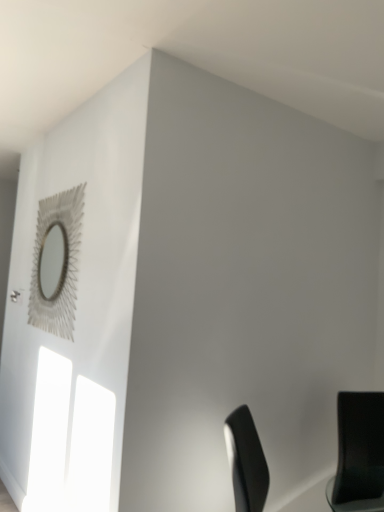
You are a GUI agent. You are given a task and a screenshot of the screen. Output one action in this format:
    pyautogui.click(x=<x>, y=<y>)
    Task: Click on the black matte chair at lower right
    This screenshot has width=384, height=512.
    Given the screenshot: What is the action you would take?
    pyautogui.click(x=359, y=453)

The width and height of the screenshot is (384, 512). What do you see at coordinates (359, 453) in the screenshot?
I see `black matte chair at lower right` at bounding box center [359, 453].

Measure the distance between point (35, 249) and camera.

3.22 meters.

Where is `metallic silver mirror at upper left`? Image resolution: width=384 pixels, height=512 pixels. metallic silver mirror at upper left is located at coordinates (56, 263).

In order to face metallic silver mirror at upper left, should I rotate leftwards or rightwards?

To face it directly, rotate left by 18.008 degrees.

The image size is (384, 512). What do you see at coordinates (56, 263) in the screenshot? I see `metallic silver mirror at upper left` at bounding box center [56, 263].

Find the location of a particular element. black matte chair at lower right is located at coordinates (359, 453).

Would you say metallic silver mirror at upper left is to the left or to the right of black matte chair at lower right in the picture?

From the image, it's evident that metallic silver mirror at upper left is to the left of black matte chair at lower right.

Between metallic silver mirror at upper left and black matte chair at lower right, which one is positioned in front?

black matte chair at lower right is in front.

Is point (46, 273) farther from viewer compared to point (355, 416)?

Yes.

From the image's perspective, would you say metallic silver mirror at upper left is shown under black matte chair at lower right?

No, from the image's perspective, metallic silver mirror at upper left is not below black matte chair at lower right.

From a real-world perspective, is metallic silver mirror at upper left above or below black matte chair at lower right?

Clearly, from a real-world perspective, metallic silver mirror at upper left is above black matte chair at lower right.

Considering the sizes of objects metallic silver mirror at upper left and black matte chair at lower right in the image provided, who is thinner, metallic silver mirror at upper left or black matte chair at lower right?

With smaller width is metallic silver mirror at upper left.

Considering the relative sizes of metallic silver mirror at upper left and black matte chair at lower right in the image provided, is metallic silver mirror at upper left taller than black matte chair at lower right?

Indeed, metallic silver mirror at upper left has a greater height compared to black matte chair at lower right.

Based on their sizes in the image, would you say metallic silver mirror at upper left is bigger or smaller than black matte chair at lower right?

In the image, metallic silver mirror at upper left appears to be smaller than black matte chair at lower right.

Does metallic silver mirror at upper left contain black matte chair at lower right?

Actually, black matte chair at lower right is outside metallic silver mirror at upper left.

Is metallic silver mirror at upper left in contact with black matte chair at lower right?

They are not placed beside each other.

Is metallic silver mirror at upper left aimed at black matte chair at lower right?

No, metallic silver mirror at upper left is not aimed at black matte chair at lower right.

How many degrees apart are the facing directions of metallic silver mirror at upper left and black matte chair at lower right?

69.3 degrees separate the facing orientations of metallic silver mirror at upper left and black matte chair at lower right.

I want to click on mirror that is above the black matte chair at lower right (from a real-world perspective), so click(56, 263).

Is black matte chair at lower right to the right of metallic silver mirror at upper left from the viewer's perspective?

Correct, you'll find black matte chair at lower right to the right of metallic silver mirror at upper left.

Considering the positions of objects black matte chair at lower right and metallic silver mirror at upper left in the image provided, who is behind, black matte chair at lower right or metallic silver mirror at upper left?

metallic silver mirror at upper left is further from the camera.

Is point (380, 436) farther from viewer compared to point (30, 294)?

That is False.

From the image's perspective, is black matte chair at lower right positioned above or below metallic silver mirror at upper left?

Based on their image positions, black matte chair at lower right is located beneath metallic silver mirror at upper left.

From a real-world perspective, is black matte chair at lower right above or below metallic silver mirror at upper left?

In terms of real-world spatial position, black matte chair at lower right is below metallic silver mirror at upper left.

Consider the image. In terms of width, does black matte chair at lower right look wider or thinner when compared to metallic silver mirror at upper left?

Considering their sizes, black matte chair at lower right looks broader than metallic silver mirror at upper left.

Which of these two, black matte chair at lower right or metallic silver mirror at upper left, stands taller?

Standing taller between the two is metallic silver mirror at upper left.

Looking at the image, does black matte chair at lower right seem bigger or smaller compared to metallic silver mirror at upper left?

Considering their sizes, black matte chair at lower right takes up more space than metallic silver mirror at upper left.

Would you say black matte chair at lower right is inside or outside metallic silver mirror at upper left?

black matte chair at lower right is not inside metallic silver mirror at upper left, it's outside.

Are black matte chair at lower right and metallic silver mirror at upper left beside each other?

They are not placed beside each other.

Could you tell me if black matte chair at lower right is turned towards metallic silver mirror at upper left?

No, black matte chair at lower right is not aimed at metallic silver mirror at upper left.

How different are the orientations of black matte chair at lower right and metallic silver mirror at upper left in degrees?

The angular difference between black matte chair at lower right and metallic silver mirror at upper left is 69.3 degrees.

Where is `mirror lying behind the black matte chair at lower right`? This screenshot has width=384, height=512. mirror lying behind the black matte chair at lower right is located at coordinates (56, 263).

At what (x,y) coordinates should I click in order to perform the action: click on mirror above the black matte chair at lower right (from a real-world perspective). Please return your answer as a coordinate pair (x, y). Looking at the image, I should click on (56, 263).

In order to click on chair below the metallic silver mirror at upper left (from the image's perspective) in this screenshot , I will do `click(359, 453)`.